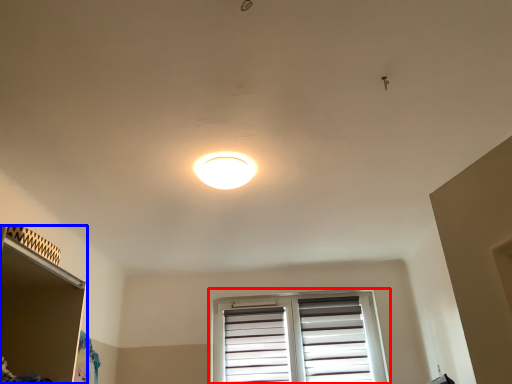
Question: Which point is closer to the camera, window (highlighted by a red box) or shelf (highlighted by a blue box)?

Choices:
 (A) window
 (B) shelf

Answer: (B)